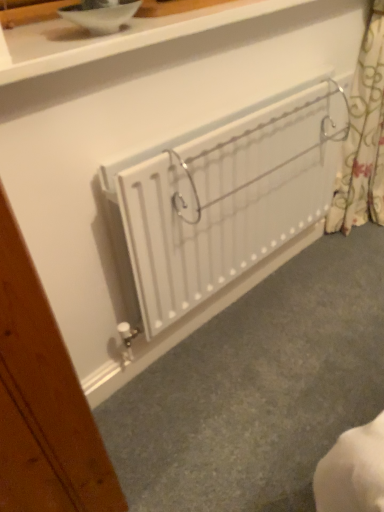
The width and height of the screenshot is (384, 512). What are the coordinates of `white matte radiator at center` in the screenshot? It's located at (221, 201).

The image size is (384, 512). What do you see at coordinates (221, 201) in the screenshot? I see `white matte radiator at center` at bounding box center [221, 201].

Where is `floral fabric curtain at right`? floral fabric curtain at right is located at coordinates (363, 138).

Describe the element at coordinates (363, 138) in the screenshot. The image size is (384, 512). I see `floral fabric curtain at right` at that location.

Locate an element on the screen. Image resolution: width=384 pixels, height=512 pixels. white matte radiator at center is located at coordinates (221, 201).

Considering the relative positions of floral fabric curtain at right and white matte radiator at center in the image provided, is floral fabric curtain at right to the right of white matte radiator at center from the viewer's perspective?

Indeed, floral fabric curtain at right is positioned on the right side of white matte radiator at center.

Who is more distant, floral fabric curtain at right or white matte radiator at center?

floral fabric curtain at right is further away from the camera.

Is point (363, 166) positioned in front of point (215, 234)?

No.

From the image's perspective, is floral fabric curtain at right on top of white matte radiator at center?

Indeed, from the image's perspective, floral fabric curtain at right is shown above white matte radiator at center.

From a real-world perspective, who is located higher, floral fabric curtain at right or white matte radiator at center?

From a 3D spatial view, floral fabric curtain at right is above.

Between floral fabric curtain at right and white matte radiator at center, which one has larger width?

floral fabric curtain at right.

Based on the photo, between floral fabric curtain at right and white matte radiator at center, which one has more height?

floral fabric curtain at right is taller.

In terms of size, does floral fabric curtain at right appear bigger or smaller than white matte radiator at center?

In the image, floral fabric curtain at right appears to be smaller than white matte radiator at center.

Would you say floral fabric curtain at right is outside white matte radiator at center?

Yes, floral fabric curtain at right is not within white matte radiator at center.

Is floral fabric curtain at right next to white matte radiator at center and touching it?

No, floral fabric curtain at right is not next to white matte radiator at center.

Is floral fabric curtain at right facing away from white matte radiator at center?

No.

What's the angular difference between floral fabric curtain at right and white matte radiator at center's facing directions?

1.28 degrees separate the facing orientations of floral fabric curtain at right and white matte radiator at center.

How much distance is there between floral fabric curtain at right and white matte radiator at center?

floral fabric curtain at right and white matte radiator at center are 51.74 centimeters apart.

You are a GUI agent. You are given a task and a screenshot of the screen. Output one action in this format:
    pyautogui.click(x=<x>, y=<y>)
    Task: Click on the radiator below the floral fabric curtain at right (from the image's perspective)
    This screenshot has height=512, width=384.
    Given the screenshot: What is the action you would take?
    pyautogui.click(x=221, y=201)

Does white matte radiator at center appear on the left side of floral fabric curtain at right?

Yes.

Is white matte radiator at center further to camera compared to floral fabric curtain at right?

No, white matte radiator at center is closer to the viewer.

Which is closer, [318,130] or [362,197]?

The point [318,130] is more forward.

From the image's perspective, which one is positioned lower, white matte radiator at center or floral fabric curtain at right?

From the image's view, white matte radiator at center is below.

From a real-world perspective, who is located higher, white matte radiator at center or floral fabric curtain at right?

floral fabric curtain at right is physically above.

Which object is thinner, white matte radiator at center or floral fabric curtain at right?

With smaller width is white matte radiator at center.

Considering the sizes of objects white matte radiator at center and floral fabric curtain at right in the image provided, who is taller, white matte radiator at center or floral fabric curtain at right?

Standing taller between the two is floral fabric curtain at right.

Considering the relative sizes of white matte radiator at center and floral fabric curtain at right in the image provided, is white matte radiator at center smaller than floral fabric curtain at right?

Incorrect, white matte radiator at center is not smaller in size than floral fabric curtain at right.

Would you say floral fabric curtain at right is part of white matte radiator at center's contents?

No, floral fabric curtain at right is not a part of white matte radiator at center.

Is white matte radiator at center placed right next to floral fabric curtain at right?

No, white matte radiator at center is not beside floral fabric curtain at right.

Is white matte radiator at center facing towards floral fabric curtain at right?

No, white matte radiator at center is not facing towards floral fabric curtain at right.

How many degrees apart are the facing directions of white matte radiator at center and floral fabric curtain at right?

The angle between the facing direction of white matte radiator at center and the facing direction of floral fabric curtain at right is 1.28 degrees.

How distant is white matte radiator at center from floral fabric curtain at right?

The distance of white matte radiator at center from floral fabric curtain at right is 20.37 inches.

At what (x,y) coordinates should I click in order to perform the action: click on curtain that appears above the white matte radiator at center (from a real-world perspective). Please return your answer as a coordinate pair (x, y). This screenshot has width=384, height=512. Looking at the image, I should click on (363, 138).

You are a GUI agent. You are given a task and a screenshot of the screen. Output one action in this format:
    pyautogui.click(x=<x>, y=<y>)
    Task: Click on the radiator below the floral fabric curtain at right (from a real-world perspective)
    The image size is (384, 512).
    Given the screenshot: What is the action you would take?
    pyautogui.click(x=221, y=201)

Image resolution: width=384 pixels, height=512 pixels. In the image, there is a white matte radiator at center. Find the location of `curtain above it (from the image's perspective)`. curtain above it (from the image's perspective) is located at coordinates (363, 138).